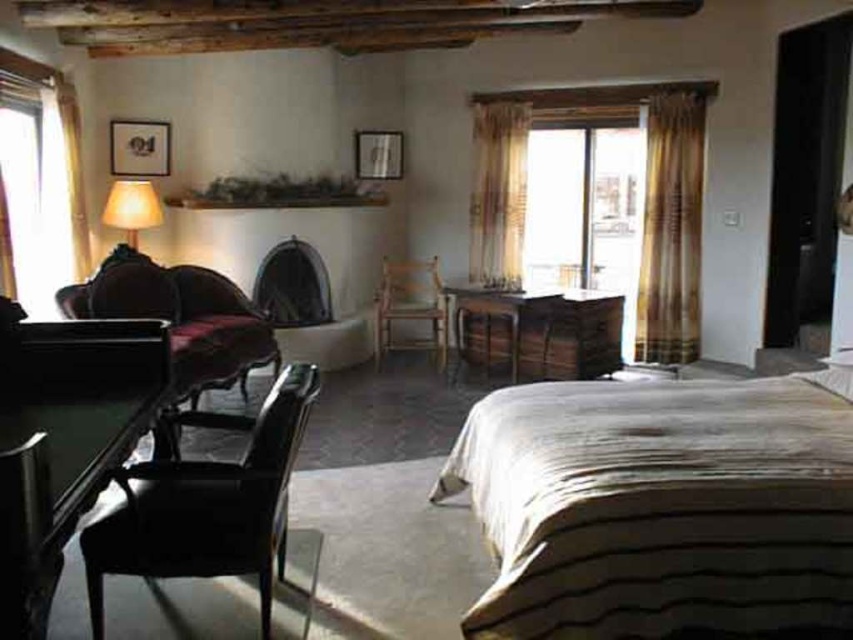
Consider the image. Can you confirm if transparent glass window at left is thinner than shiny dark wood table at lower left?

Yes, transparent glass window at left is thinner than shiny dark wood table at lower left.

Which is above, transparent glass window at left or shiny dark wood table at lower left?

transparent glass window at left

Is point (36, 173) more distant than point (27, 472)?

Yes, it is.

Identify the location of transparent glass window at left. (39, 182).

Between transparent glass window at left and matte fabric lampshade at left, which one appears on the left side from the viewer's perspective?

From the viewer's perspective, transparent glass window at left appears more on the left side.

Measure the distance between point (x=28, y=113) and camera.

16.80 feet

The width and height of the screenshot is (853, 640). In order to click on transparent glass window at left in this screenshot , I will do `click(39, 182)`.

Can you confirm if wooden table at center is taller than translucent floral fabric at center?

In fact, wooden table at center may be shorter than translucent floral fabric at center.

Consider the image. Is wooden table at center thinner than translucent floral fabric at center?

No.

The image size is (853, 640). Identify the location of wooden table at center. (538, 332).